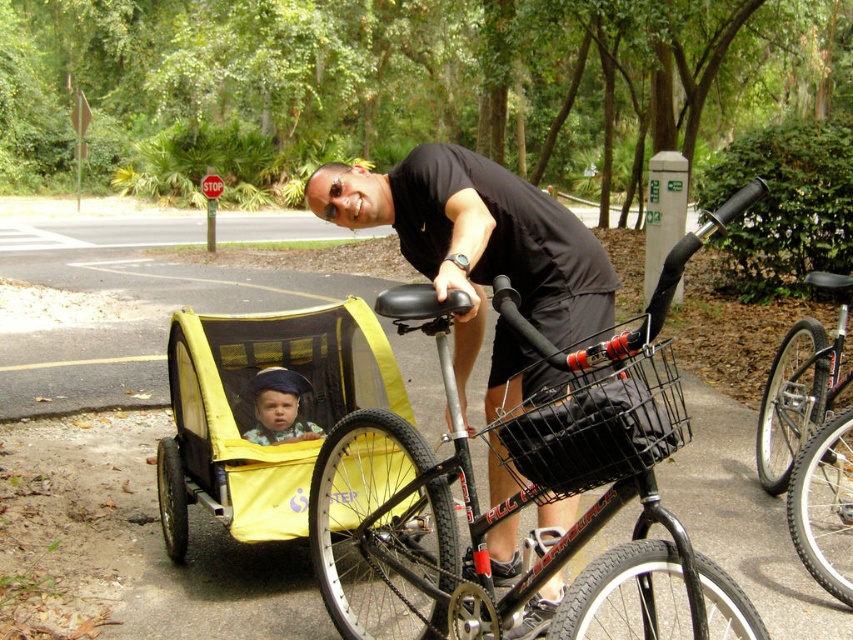
Where is the shiny silver wheel at lower right located in the image?

The shiny silver wheel at lower right is located at point coordinates of (824, 506).

From the picture: You are a photographer trying to capture a clear photo of the yellow fabric baby carriage at center and the blue denim hat at center. Which object should you focus on if you want the one that is more to the right?

The yellow fabric baby carriage at center is positioned on the right side of blue denim hat at center, so you should focus on the yellow fabric baby carriage at center to capture the one more to the right.

You are standing in the park and see the black wire basket at center and the black matte bicycle at right. Which object is positioned to the left of the other?

The black wire basket at center is positioned to the left of the black matte bicycle at right.